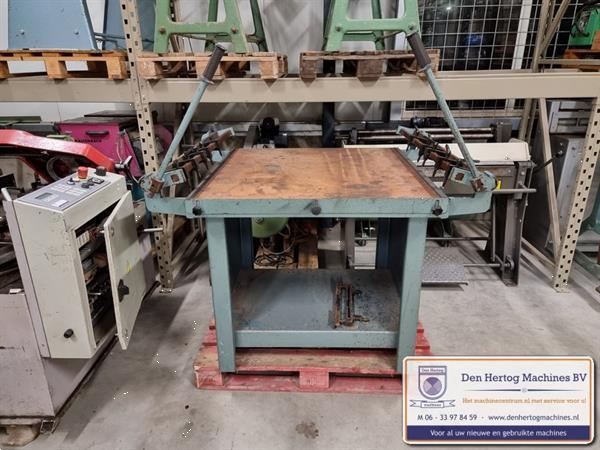
Identify the location of grey floor. pyautogui.click(x=273, y=413).